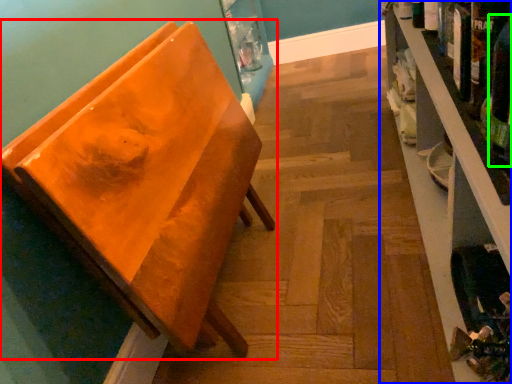
Question: Based on their relative distances, which object is nearer to furniture (highlighted by a red box)? Choose from shelf (highlighted by a blue box) and beer bottle (highlighted by a green box).

Choices:
 (A) shelf
 (B) beer bottle

Answer: (A)